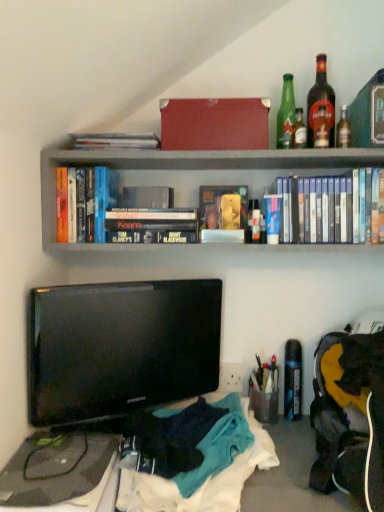
Where is `empty space that is ontop of hardcover books at upper center (from a real-world perspective)`? empty space that is ontop of hardcover books at upper center (from a real-world perspective) is located at coordinates (219, 147).